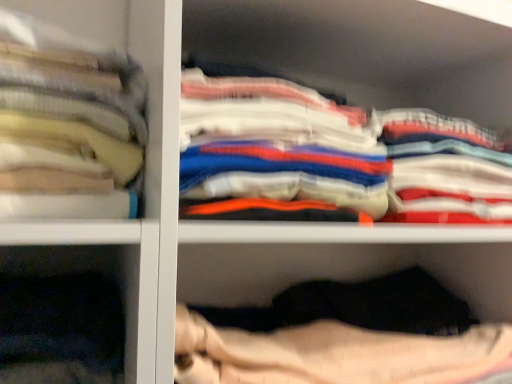
Question: Should I look upward or downward to see soft cotton towels at left, which appears as the 1th clothing when viewed from the left?

Choices:
 (A) down
 (B) up

Answer: (B)

Question: Which direction should I rotate to look at white cotton shirts at center, placed as the second clothing when sorted from right to left?

Choices:
 (A) right
 (B) left

Answer: (A)

Question: Is white cotton shirts at upper right, the 3th clothing in the left-to-right sequence, not near white cotton shirts at center, the second clothing viewed from the left?

Choices:
 (A) yes
 (B) no

Answer: (B)

Question: Is white cotton shirts at upper right, the 1th clothing when ordered from right to left, positioned with its back to white cotton shirts at center, placed as the second clothing when sorted from right to left?

Choices:
 (A) no
 (B) yes

Answer: (A)

Question: Considering the relative sizes of white cotton shirts at upper right, the 3th clothing in the left-to-right sequence, and white cotton shirts at center, placed as the second clothing when sorted from right to left, in the image provided, is white cotton shirts at upper right, the 3th clothing in the left-to-right sequence, wider than white cotton shirts at center, placed as the second clothing when sorted from right to left,?

Choices:
 (A) yes
 (B) no

Answer: (B)

Question: Is white cotton shirts at upper right, the 1th clothing when ordered from right to left, to the right of white cotton shirts at center, the second clothing viewed from the left, from the viewer's perspective?

Choices:
 (A) yes
 (B) no

Answer: (A)

Question: Considering the relative positions of white cotton shirts at upper right, the 1th clothing when ordered from right to left, and white cotton shirts at center, placed as the second clothing when sorted from right to left, in the image provided, is white cotton shirts at upper right, the 1th clothing when ordered from right to left, to the left of white cotton shirts at center, placed as the second clothing when sorted from right to left, from the viewer's perspective?

Choices:
 (A) no
 (B) yes

Answer: (A)

Question: Considering the relative sizes of white cotton shirts at upper right, the 3th clothing in the left-to-right sequence, and white cotton shirts at center, placed as the second clothing when sorted from right to left, in the image provided, is white cotton shirts at upper right, the 3th clothing in the left-to-right sequence, bigger than white cotton shirts at center, placed as the second clothing when sorted from right to left,?

Choices:
 (A) yes
 (B) no

Answer: (B)

Question: From a real-world perspective, is soft cotton towels at left, which appears as the 1th clothing when viewed from the left, physically above white cotton shirts at center, the second clothing viewed from the left?

Choices:
 (A) yes
 (B) no

Answer: (A)

Question: Is soft cotton towels at left, arranged as the third clothing when viewed from the right, to the right of white cotton shirts at center, the second clothing viewed from the left, from the viewer's perspective?

Choices:
 (A) yes
 (B) no

Answer: (B)

Question: Is soft cotton towels at left, arranged as the third clothing when viewed from the right, positioned far away from white cotton shirts at center, the second clothing viewed from the left?

Choices:
 (A) no
 (B) yes

Answer: (A)

Question: Is white cotton shirts at center, placed as the second clothing when sorted from right to left, a part of soft cotton towels at left, arranged as the third clothing when viewed from the right?

Choices:
 (A) no
 (B) yes

Answer: (A)

Question: Is soft cotton towels at left, which appears as the 1th clothing when viewed from the left, at the left side of white cotton shirts at center, the second clothing viewed from the left?

Choices:
 (A) yes
 (B) no

Answer: (A)

Question: Is soft cotton towels at left, arranged as the third clothing when viewed from the right, smaller than white cotton shirts at center, placed as the second clothing when sorted from right to left?

Choices:
 (A) no
 (B) yes

Answer: (B)

Question: From a real-world perspective, is white cotton shirts at center, the second clothing viewed from the left, positioned over white cotton shirts at upper right, the 3th clothing in the left-to-right sequence, based on gravity?

Choices:
 (A) yes
 (B) no

Answer: (A)